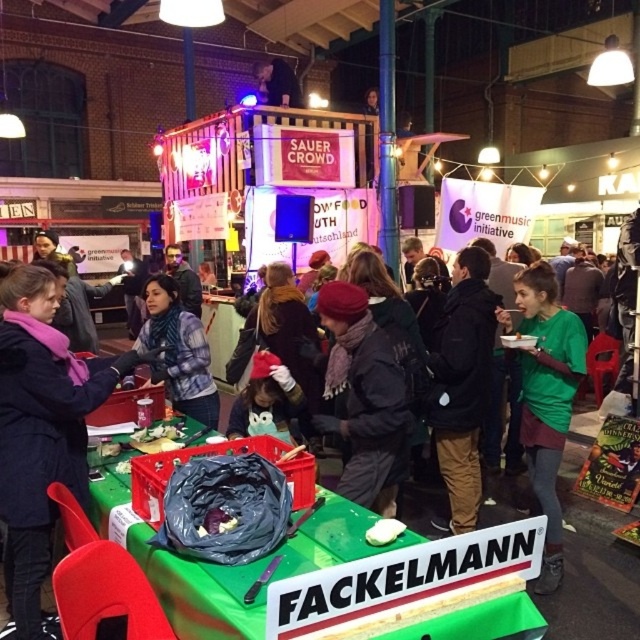
You are standing in the middle of the event hall and see two points marked in the image. Which point is closer to you, point (563, 374) or point (380, 524)?

Point (563, 374) is closer to you because it is further to the viewer than point (380, 524).

Consider the image. You are a photographer at the event and need to capture both the dark blue jacket at center and the smooth purple potato at center in the same frame. Which object should you position to the left side of your camera frame to ensure both are visible?

To ensure both the dark blue jacket at center and the smooth purple potato at center are visible in the same frame, you should position the dark blue jacket at center on the left side of your camera frame since it is already on the left side of the smooth purple potato at center.